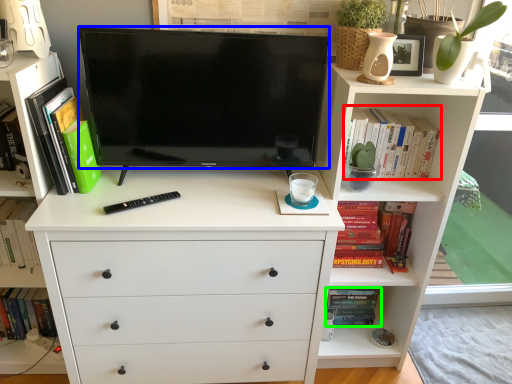
Question: Which is farther away from book (highlighted by a red box)? television (highlighted by a blue box) or book (highlighted by a green box)?

Choices:
 (A) television
 (B) book

Answer: (B)